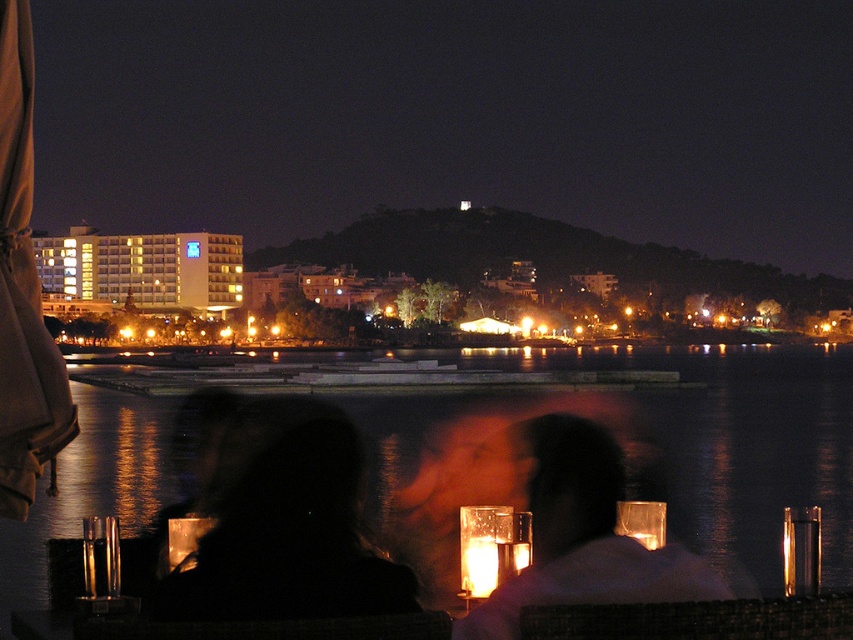
You are standing at the edge of the waterfront and see two points in the scene. Which point, point (x=329, y=556) or point (x=318, y=518), is closer to you?

Point (x=329, y=556) is closer to the viewer than point (x=318, y=518).

You are a photographer trying to capture the reflection of the silhouette glass at lower center and the black matte hair at center in the water. Which object will appear closer to the bottom edge of your photo?

The silhouette glass at lower center will appear closer to the bottom edge of your photo because it is located below the black matte hair at center.